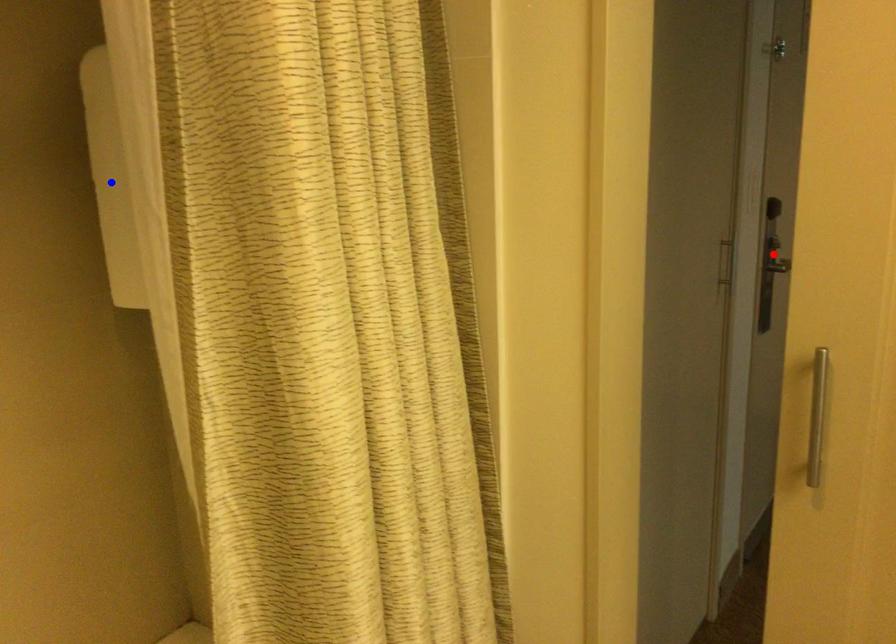
Question: In the image, two points are highlighted. Which point is nearer to the camera? Reply with the corresponding letter.

Choices:
 (A) blue point
 (B) red point

Answer: (A)